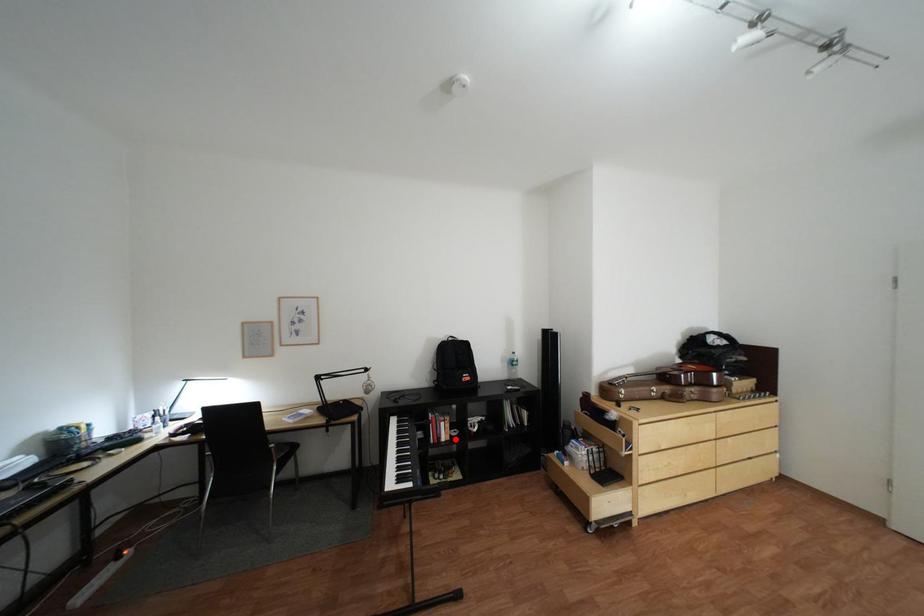
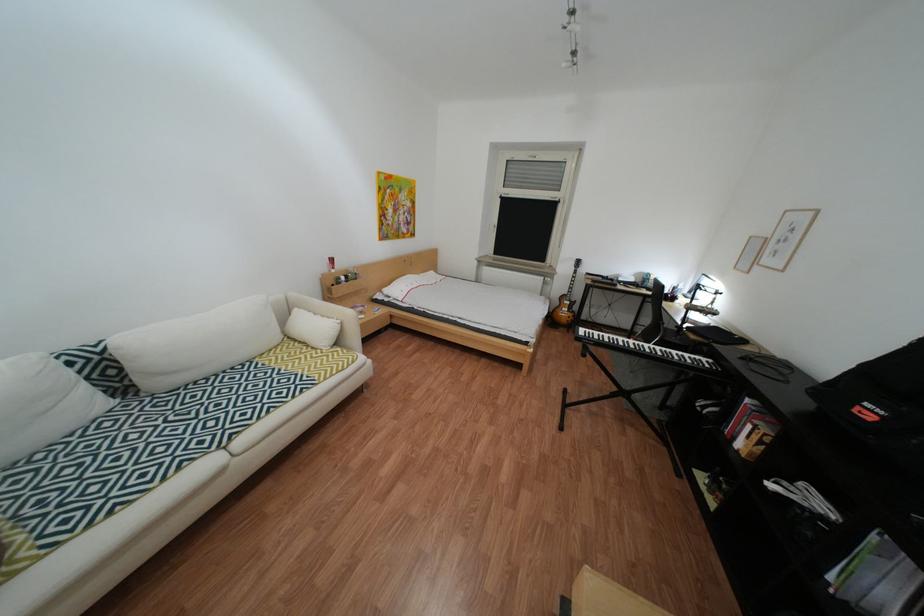
In the second image, find the point that corresponds to the highlighted location in the first image.

(749, 439)